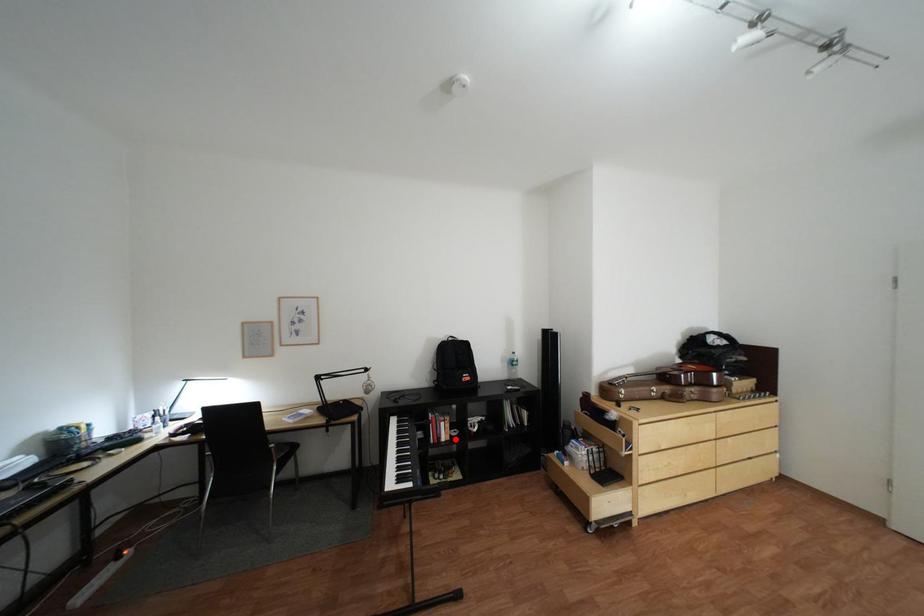
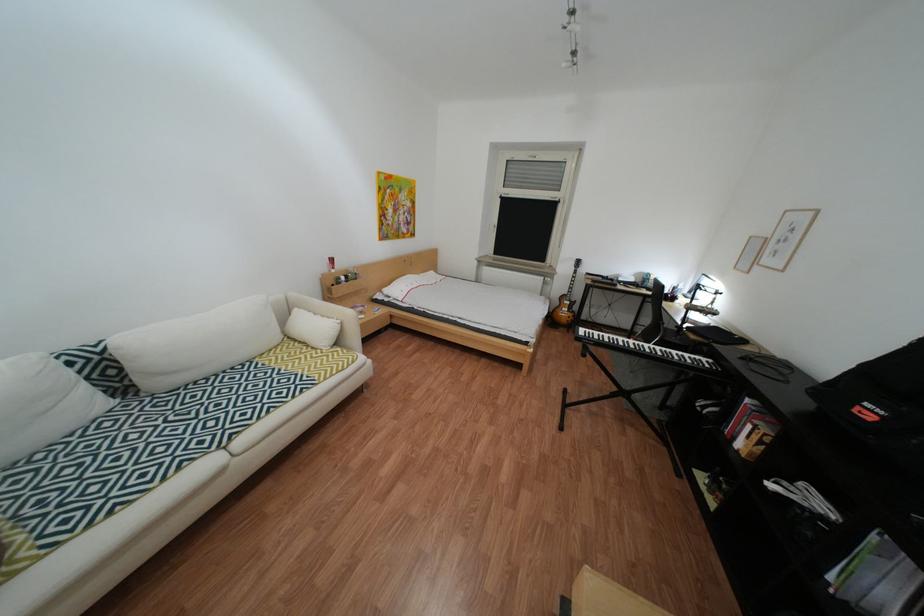
In the second image, find the point that corresponds to the highlighted location in the first image.

(749, 439)